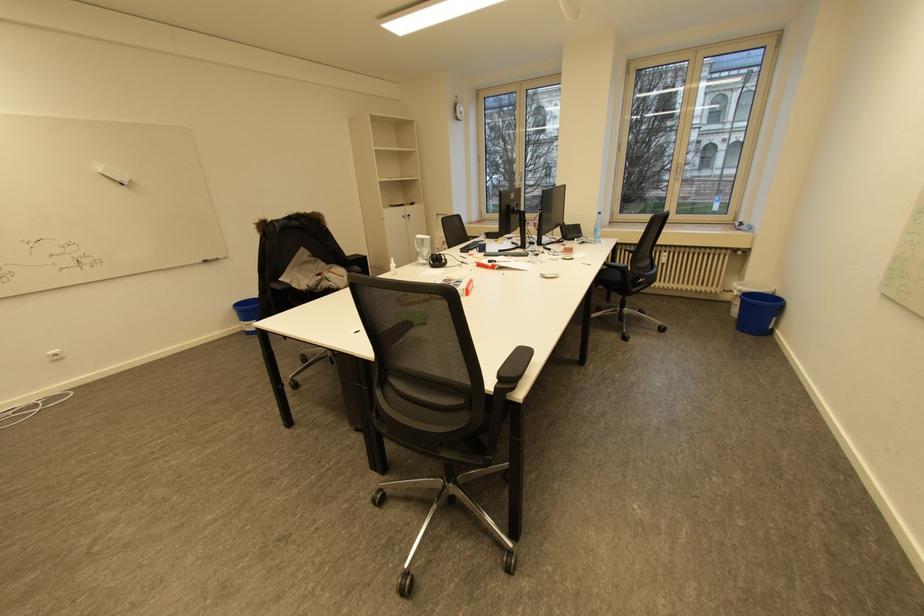
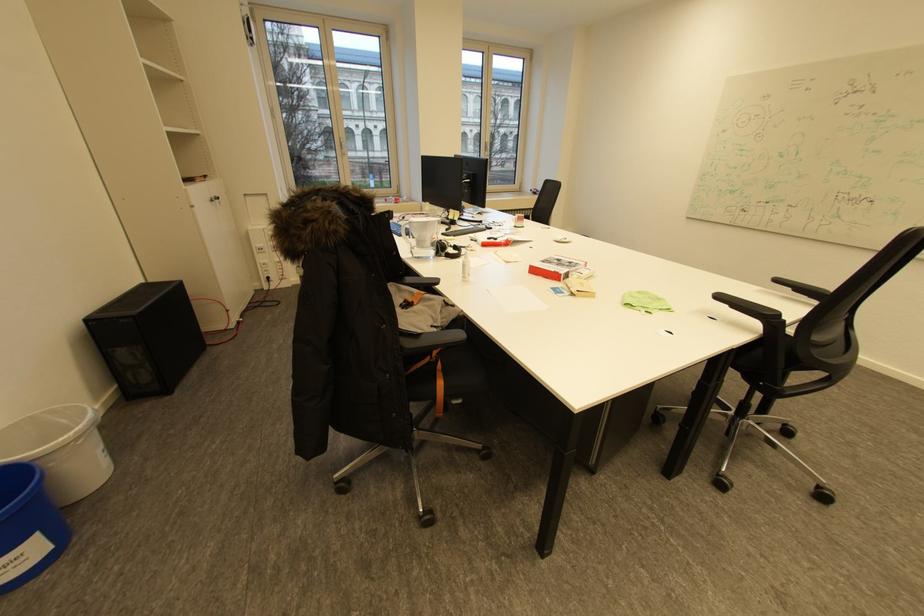
Question: I am providing you with two images of the same scene from different viewpoints. After the viewpoint changes to image2, which objects are now occluded?

Choices:
 (A) black chair armrest
 (B) white cabinet handle
 (C) black backpack strap
 (D) red cardboard box

Answer: (A)